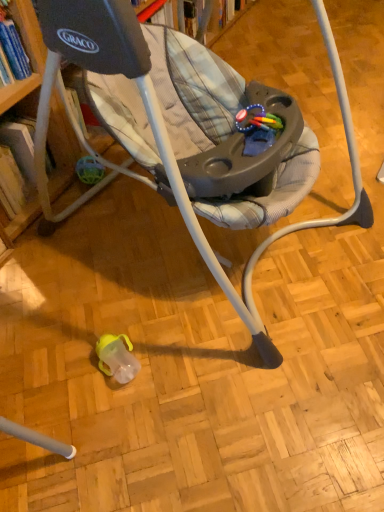
I want to click on free region under matte gray baby swing at center (from a real-world perspective), so click(193, 247).